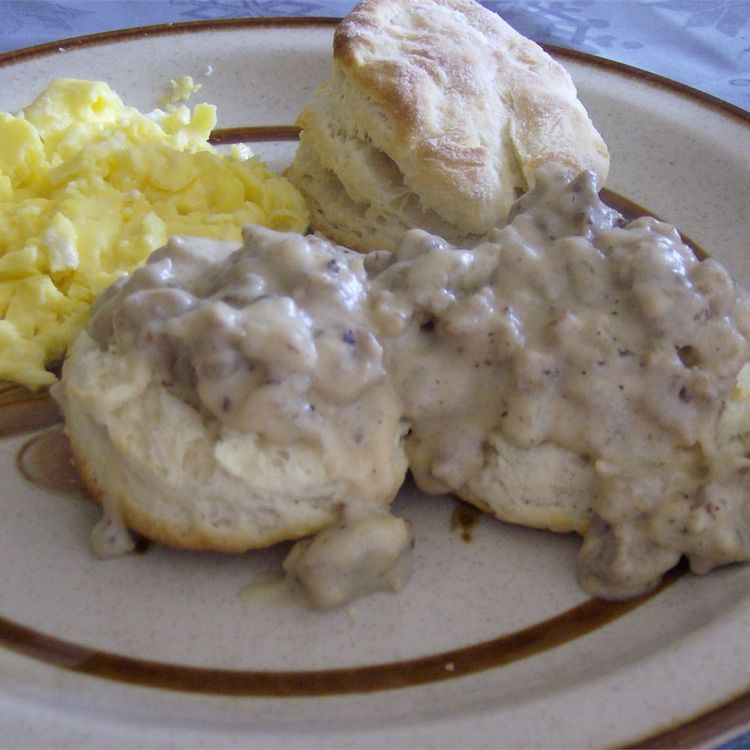
I want to click on edge of dinner plate, so click(720, 723).